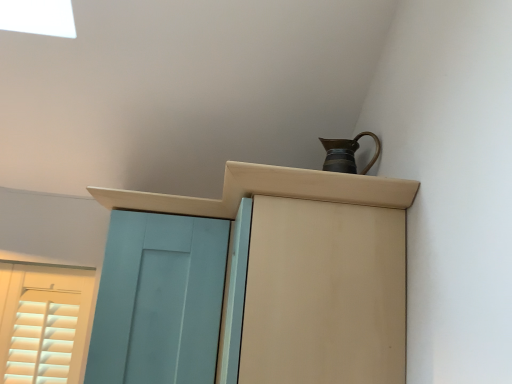
Question: Is teal matte door at left at the back of matte wood cabinet at upper center?

Choices:
 (A) yes
 (B) no

Answer: (B)

Question: Is matte wood cabinet at upper center smaller than teal matte door at left?

Choices:
 (A) yes
 (B) no

Answer: (B)

Question: Is matte wood cabinet at upper center beside teal matte door at left?

Choices:
 (A) yes
 (B) no

Answer: (B)

Question: Considering the relative positions of matte wood cabinet at upper center and teal matte door at left in the image provided, is matte wood cabinet at upper center in front of teal matte door at left?

Choices:
 (A) yes
 (B) no

Answer: (A)

Question: Does matte wood cabinet at upper center contain teal matte door at left?

Choices:
 (A) yes
 (B) no

Answer: (B)

Question: In terms of height, does matte wood cabinet at upper center look taller or shorter compared to metallic brown jug at upper right?

Choices:
 (A) short
 (B) tall

Answer: (B)

Question: Considering the positions of point (384, 297) and point (345, 160), is point (384, 297) closer or farther from the camera than point (345, 160)?

Choices:
 (A) closer
 (B) farther

Answer: (A)

Question: From a real-world perspective, is matte wood cabinet at upper center positioned above or below metallic brown jug at upper right?

Choices:
 (A) below
 (B) above

Answer: (A)

Question: Is matte wood cabinet at upper center bigger or smaller than metallic brown jug at upper right?

Choices:
 (A) small
 (B) big

Answer: (B)

Question: Considering the positions of point (141, 261) and point (313, 223), is point (141, 261) closer or farther from the camera than point (313, 223)?

Choices:
 (A) farther
 (B) closer

Answer: (A)

Question: Is teal matte door at left inside or outside of matte wood cabinet at upper center?

Choices:
 (A) inside
 (B) outside

Answer: (B)

Question: From the image's perspective, is teal matte door at left located above or below matte wood cabinet at upper center?

Choices:
 (A) above
 (B) below

Answer: (B)

Question: Looking at their shapes, would you say teal matte door at left is wider or thinner than matte wood cabinet at upper center?

Choices:
 (A) thin
 (B) wide

Answer: (B)

Question: Considering the positions of teal matte door at left and matte brown cupboard at upper right in the image, is teal matte door at left wider or thinner than matte brown cupboard at upper right?

Choices:
 (A) wide
 (B) thin

Answer: (B)

Question: Does point (202, 340) appear closer or farther from the camera than point (367, 228)?

Choices:
 (A) farther
 (B) closer

Answer: (A)